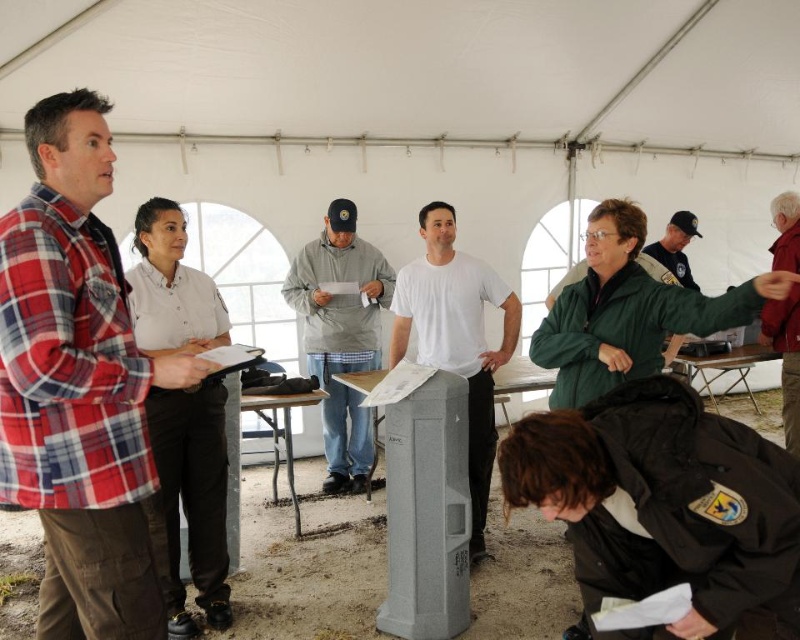
Is point (152, 529) more distant than point (714, 394)?

That is False.

The width and height of the screenshot is (800, 640). I want to click on white shirt at left, so click(192, 499).

What do you see at coordinates (192, 499) in the screenshot? This screenshot has width=800, height=640. I see `white shirt at left` at bounding box center [192, 499].

At what (x,y) coordinates should I click in order to perform the action: click on white shirt at left. Please return your answer as a coordinate pair (x, y). The width and height of the screenshot is (800, 640). Looking at the image, I should click on (192, 499).

Is plaid flannel shirt at left to the right of metallic silver table at center from the viewer's perspective?

In fact, plaid flannel shirt at left is to the left of metallic silver table at center.

Does plaid flannel shirt at left have a smaller size compared to metallic silver table at center?

Yes.

Between point (88, 388) and point (714, 401), which one is positioned in front?

Point (88, 388) is more forward.

The height and width of the screenshot is (640, 800). What are the coordinates of `plaid flannel shirt at left` in the screenshot? It's located at (78, 385).

Which is more to the right, white matte pedestal at center or metallic silver table at center?

From the viewer's perspective, metallic silver table at center appears more on the right side.

Identify the location of white matte pedestal at center. (456, 337).

Identify the location of white matte pedestal at center. [456, 337].